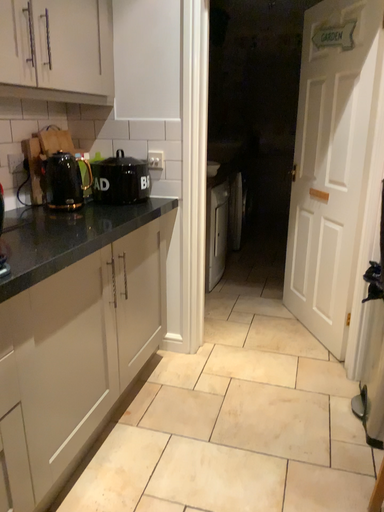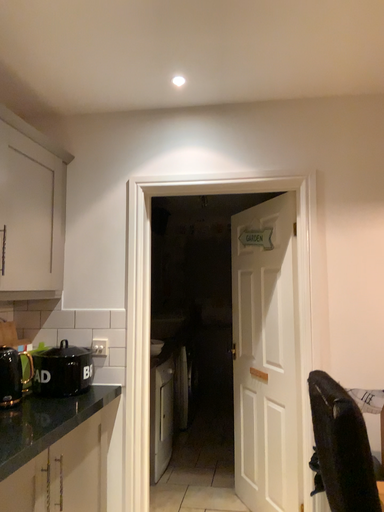
Question: Which way did the camera rotate in the video?

Choices:
 (A) rotated right
 (B) rotated left

Answer: (A)